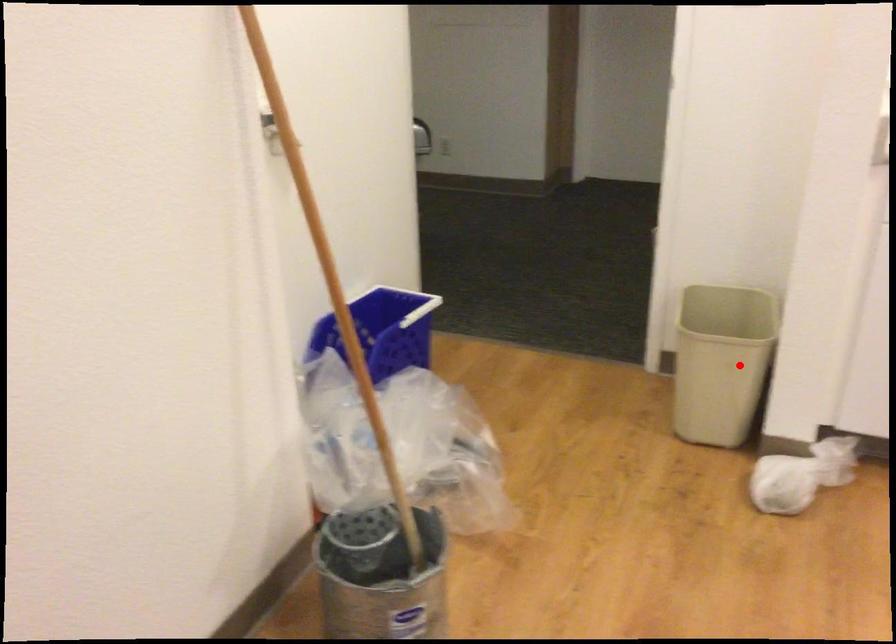
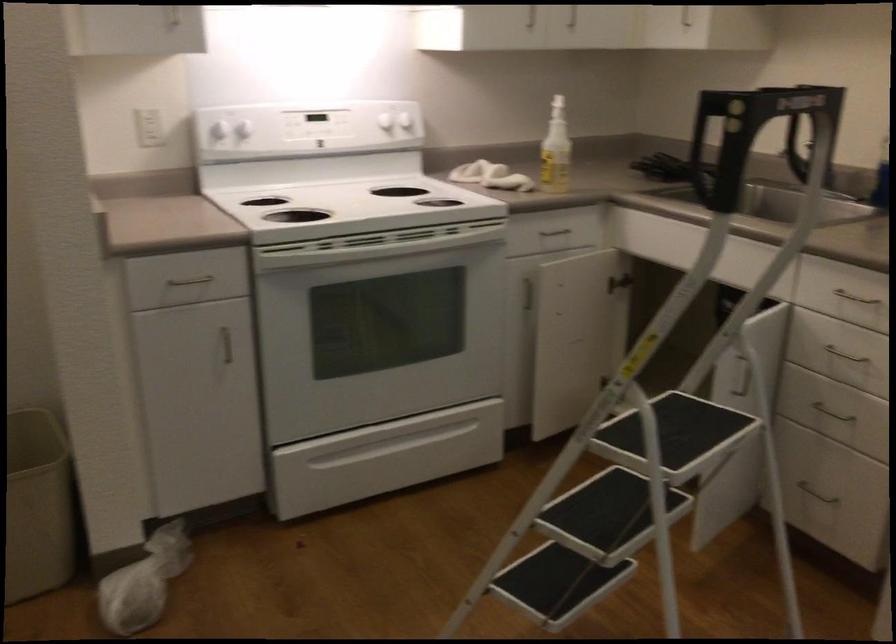
Find the pixel in the second image that matches the highlighted location in the first image.

(38, 506)